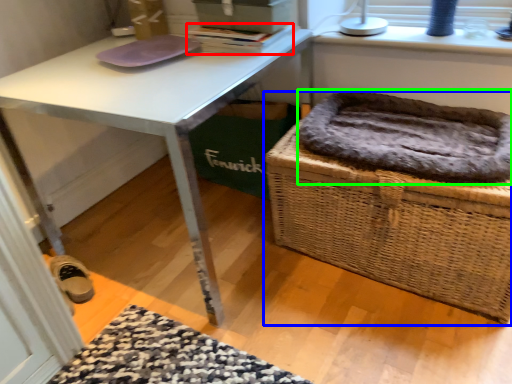
Question: Considering the real-world distances, which object is farthest from book (highlighted by a red box)? picnic basket (highlighted by a blue box) or cat bed (highlighted by a green box)?

Choices:
 (A) picnic basket
 (B) cat bed

Answer: (A)